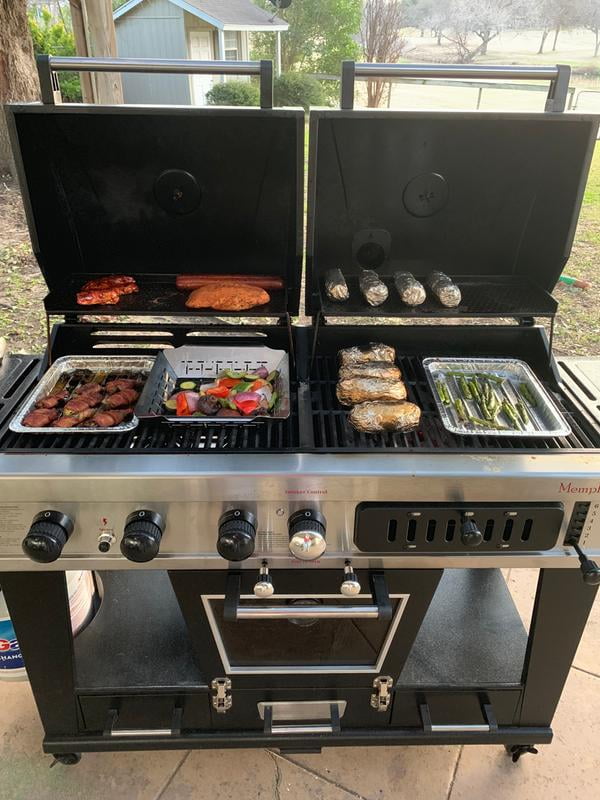
Identify the location of knob. (134, 545).